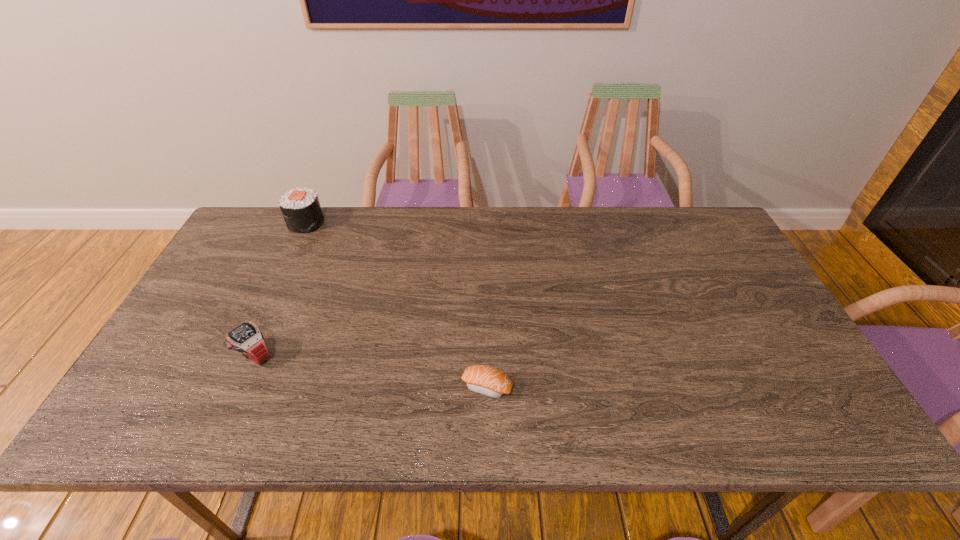
At what (x,y) coordinates should I click in order to perform the action: click on free space that satisfies the following two spatial constraints: 1. on the front side of the right sushi; 2. on the left side of the tallest object. Please return your answer as a coordinate pair (x, y). This screenshot has height=540, width=960. Looking at the image, I should click on (230, 387).